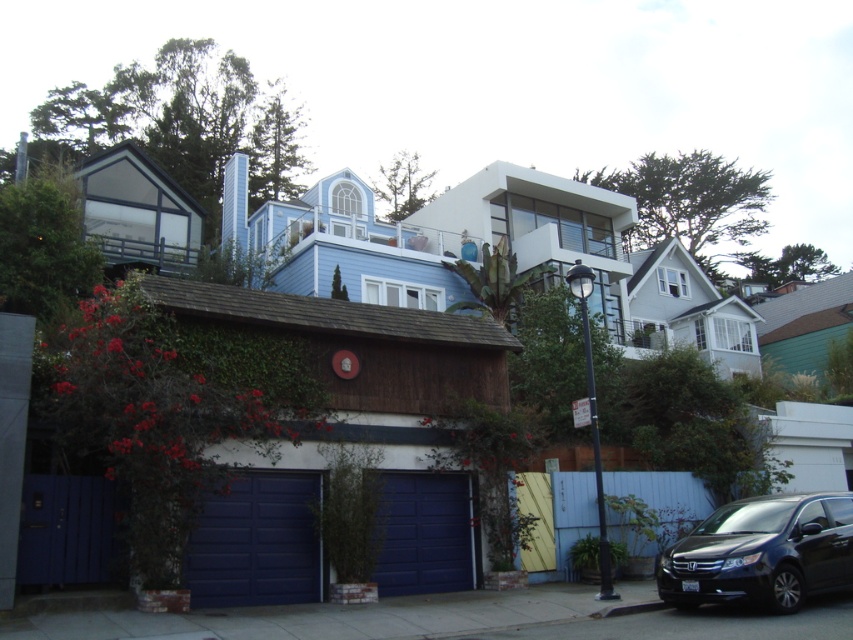
Who is more distant from viewer, (804, 540) or (241, 556)?

The point (241, 556) is more distant.

Which is more to the right, black glossy minivan at lower right or blue smooth garage door at lower left?

black glossy minivan at lower right is more to the right.

Where is `black glossy minivan at lower right`? Image resolution: width=853 pixels, height=640 pixels. black glossy minivan at lower right is located at coordinates (762, 552).

Does black glossy minivan at lower right have a greater height compared to blue matte/glossy garage door at center?

In fact, black glossy minivan at lower right may be shorter than blue matte/glossy garage door at center.

Based on the photo, who is more forward, [735,534] or [450,497]?

Point [735,534] is in front.

Find the location of `black glossy minivan at lower right`. black glossy minivan at lower right is located at coordinates (762, 552).

What do you see at coordinates (257, 541) in the screenshot?
I see `blue smooth garage door at lower left` at bounding box center [257, 541].

Is blue smooth garage door at lower left shorter than blue matte/glossy garage door at center?

Correct, blue smooth garage door at lower left is not as tall as blue matte/glossy garage door at center.

Is point (267, 488) positioned in front of point (461, 561)?

Yes.

Locate an element on the screen. blue smooth garage door at lower left is located at coordinates (257, 541).